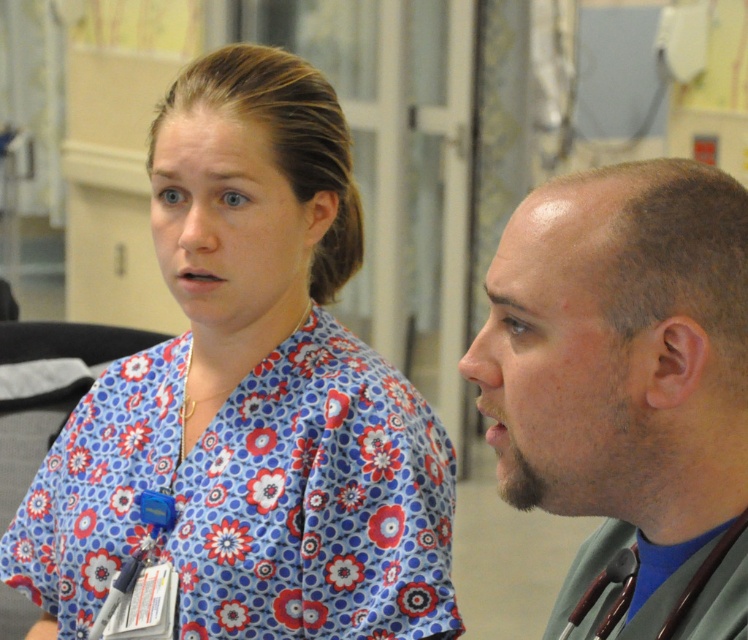
Consider the image. Can you confirm if floral print scrubs at center is taller than gray stethoscope at right?

Indeed, floral print scrubs at center has a greater height compared to gray stethoscope at right.

Image resolution: width=748 pixels, height=640 pixels. What do you see at coordinates (251, 397) in the screenshot?
I see `floral print scrubs at center` at bounding box center [251, 397].

Between point (337, 557) and point (640, 168), which one is positioned behind?

Point (337, 557)

At what (x,y) coordinates should I click in order to perform the action: click on floral print scrubs at center. Please return your answer as a coordinate pair (x, y). This screenshot has height=640, width=748. Looking at the image, I should click on (251, 397).